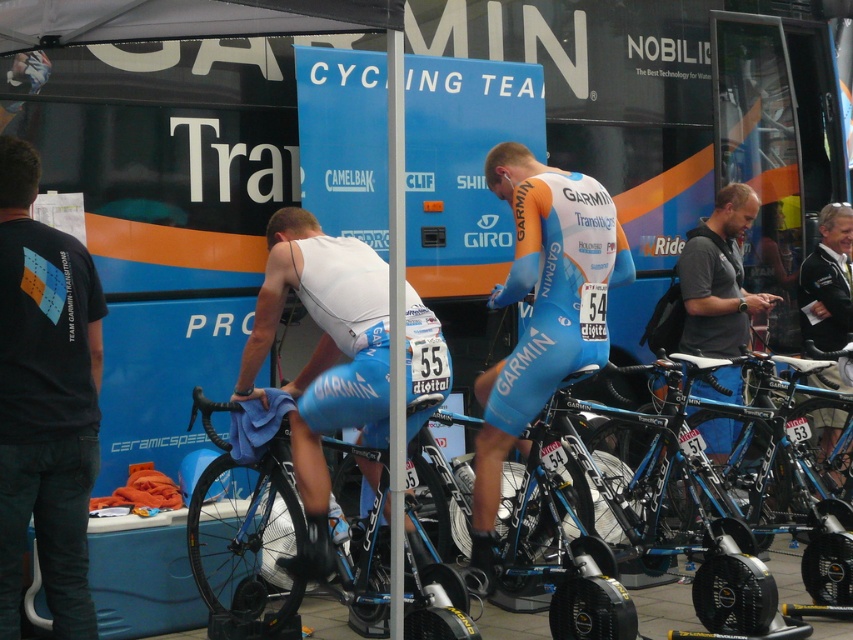
Does white matte cycling jersey at center appear under blue carbon fiber bicycle at center?

No.

Does point (328, 356) come in front of point (204, 602)?

No, (328, 356) is behind (204, 602).

Which is behind, point (287, 273) or point (289, 460)?

The point (289, 460) is more distant.

Image resolution: width=853 pixels, height=640 pixels. I want to click on white matte cycling jersey at center, so click(323, 356).

Which is above, matte blue cycling suit at center or blue carbon fiber bicycle at center?

matte blue cycling suit at center

Describe the element at coordinates (543, 308) in the screenshot. This screenshot has width=853, height=640. I see `matte blue cycling suit at center` at that location.

Which is behind, point (582, 317) or point (262, 620)?

Positioned behind is point (582, 317).

Image resolution: width=853 pixels, height=640 pixels. What are the coordinates of `matte blue cycling suit at center` in the screenshot? It's located at (543, 308).

Is white matte cycling jersey at center taller than white plastic pole at center?

No, white matte cycling jersey at center is not taller than white plastic pole at center.

Can you confirm if white matte cycling jersey at center is wider than white plastic pole at center?

Yes.

Is point (291, 237) closer to camera compared to point (399, 298)?

No, (291, 237) is further to viewer.

Image resolution: width=853 pixels, height=640 pixels. In order to click on white matte cycling jersey at center in this screenshot , I will do `click(323, 356)`.